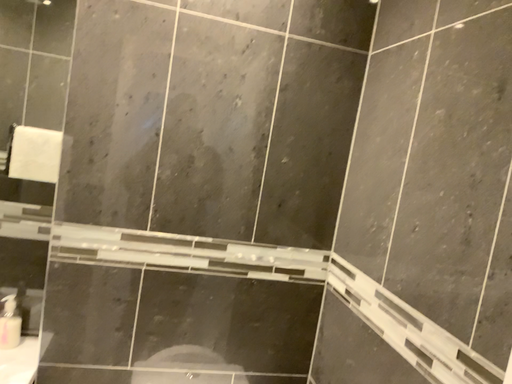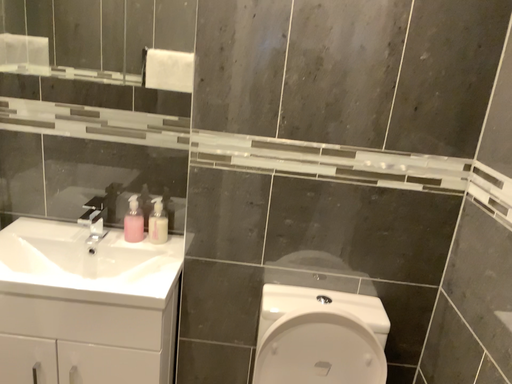
Question: Which way did the camera rotate in the video?

Choices:
 (A) rotated left
 (B) rotated right

Answer: (A)